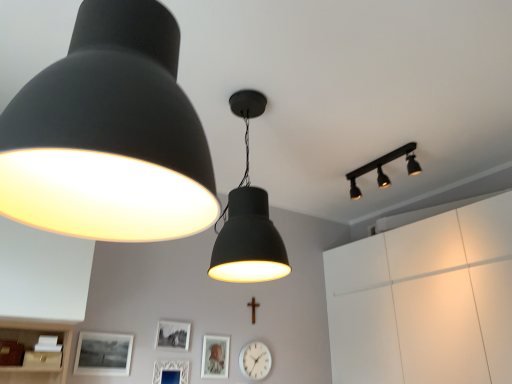
Question: Is matte black track light at upper right, which is the 1th lamp in back-to-front order, not inside matte black lampshade at upper left, the first lamp positioned from the front?

Choices:
 (A) yes
 (B) no

Answer: (A)

Question: Can you confirm if matte black track light at upper right, which is the 1th lamp in back-to-front order, is smaller than matte black lampshade at upper left, which appears as the 3th lamp when viewed from the right?

Choices:
 (A) no
 (B) yes

Answer: (B)

Question: Is matte black track light at upper right, which is the 1th lamp from right to left, thinner than matte black lampshade at upper left, the first lamp positioned from the front?

Choices:
 (A) yes
 (B) no

Answer: (B)

Question: From a real-world perspective, is matte black track light at upper right, which is counted as the 3th lamp, starting from the front, under matte black lampshade at upper left, the first lamp positioned from the front?

Choices:
 (A) yes
 (B) no

Answer: (B)

Question: From the image's perspective, is matte black track light at upper right, which is the 1th lamp in back-to-front order, under matte black lampshade at upper left, the first lamp positioned from the front?

Choices:
 (A) yes
 (B) no

Answer: (A)

Question: Would you say white matte cabinet at upper right is to the left or to the right of matte black lampshade at center, which appears as the 2th lamp when viewed from the left, in the picture?

Choices:
 (A) left
 (B) right

Answer: (B)

Question: From a real-world perspective, relative to matte black lampshade at center, which is counted as the second lamp, starting from the right, is white matte cabinet at upper right vertically above or below?

Choices:
 (A) below
 (B) above

Answer: (A)

Question: From the image's perspective, is white matte cabinet at upper right located above or below matte black lampshade at center, the second lamp when ordered from front to back?

Choices:
 (A) below
 (B) above

Answer: (A)

Question: Does point (343, 357) appear closer or farther from the camera than point (271, 231)?

Choices:
 (A) farther
 (B) closer

Answer: (A)

Question: Relative to matte silver picture frame at center, which appears as the fourth picture frame when viewed from the left, is matte black picture frame at lower center, arranged as the third picture frame when viewed from the right, in front or behind?

Choices:
 (A) front
 (B) behind

Answer: (A)

Question: Based on their positions, is matte black picture frame at lower center, arranged as the third picture frame when viewed from the right, located to the left or right of matte silver picture frame at center, which appears as the fourth picture frame when viewed from the left?

Choices:
 (A) left
 (B) right

Answer: (A)

Question: In terms of width, does matte black picture frame at lower center, which appears as the 2th picture frame when viewed from the left, look wider or thinner when compared to matte silver picture frame at center, which ranks as the 1th picture frame in right-to-left order?

Choices:
 (A) wide
 (B) thin

Answer: (A)

Question: Considering the positions of point (186, 326) and point (203, 359), is point (186, 326) closer or farther from the camera than point (203, 359)?

Choices:
 (A) farther
 (B) closer

Answer: (B)

Question: Considering the positions of matte black track light at upper right, positioned as the 3th lamp in left-to-right order, and matte black lampshade at upper left, the first lamp positioned from the front, in the image, is matte black track light at upper right, positioned as the 3th lamp in left-to-right order, bigger or smaller than matte black lampshade at upper left, the first lamp positioned from the front,?

Choices:
 (A) big
 (B) small

Answer: (B)

Question: From the image's perspective, is matte black track light at upper right, which is counted as the 3th lamp, starting from the front, above or below matte black lampshade at upper left, which appears as the 3th lamp when viewed from the right?

Choices:
 (A) below
 (B) above

Answer: (A)